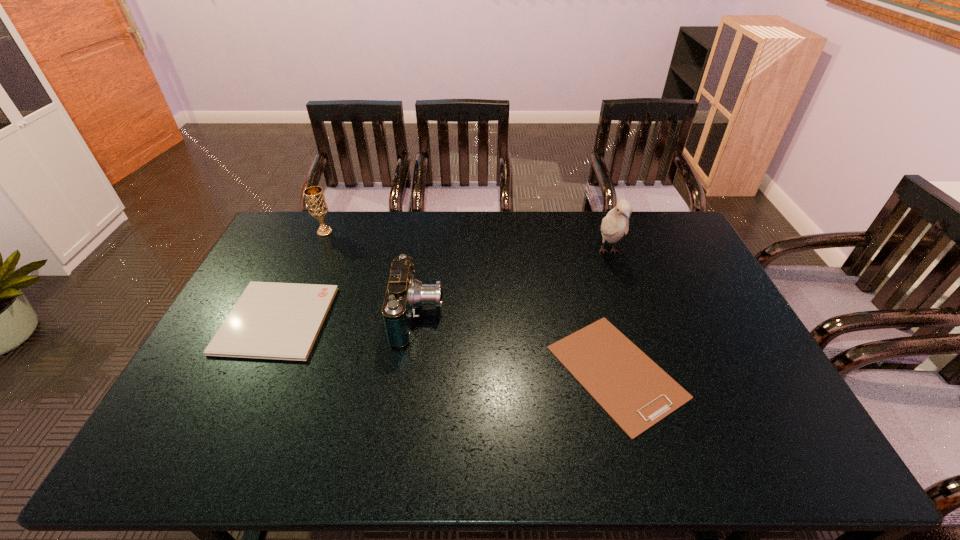
Find the location of a particular element. the tallest object is located at coordinates (616, 223).

Where is `chalice`? The height and width of the screenshot is (540, 960). chalice is located at coordinates (317, 206).

The width and height of the screenshot is (960, 540). I want to click on the third object from right to left, so click(x=405, y=294).

Identify the location of camcorder. (405, 294).

At what (x,y) coordinates should I click in order to perform the action: click on the left clipboard. Please return your answer as a coordinate pair (x, y). The image size is (960, 540). Looking at the image, I should click on (270, 320).

In order to click on the second shortest object in this screenshot , I will do `click(270, 320)`.

This screenshot has height=540, width=960. I want to click on the shorter clipboard, so click(636, 393).

At what (x,y) coordinates should I click in order to perform the action: click on the right clipboard. Please return your answer as a coordinate pair (x, y). This screenshot has width=960, height=540. Looking at the image, I should click on tap(636, 393).

Find the location of `vacant point located 0.250m at the beak of the tallest object`. vacant point located 0.250m at the beak of the tallest object is located at coordinates (635, 327).

Where is `free space located on the right of the chalice`? free space located on the right of the chalice is located at coordinates (408, 232).